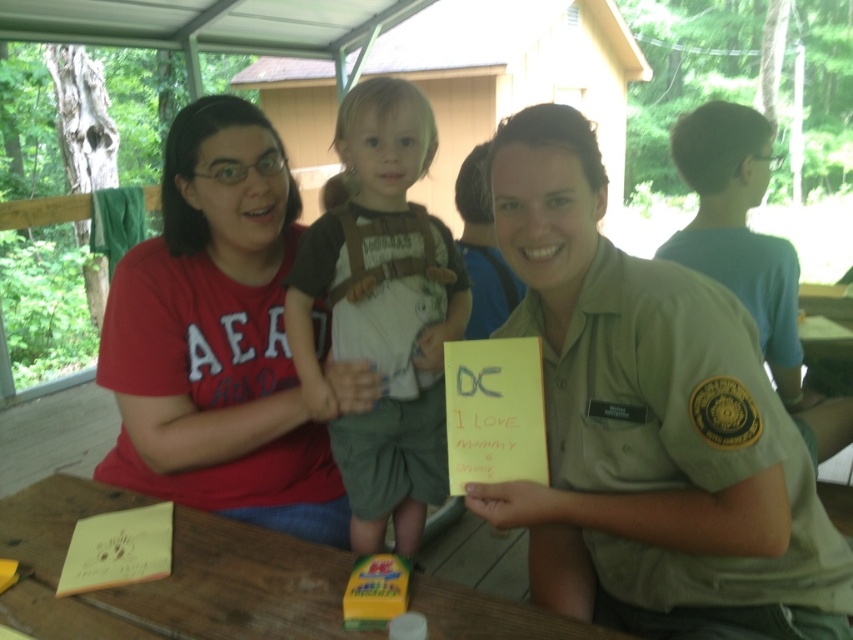
Question: Which point appears closest to the camera in this image?

Choices:
 (A) (843, 417)
 (B) (177, 426)
 (C) (440, 637)
 (D) (457, 328)

Answer: (C)

Question: Which point appears closest to the camera in this image?

Choices:
 (A) (730, 230)
 (B) (25, 560)

Answer: (B)

Question: Can you confirm if brown cotton shirt at center is positioned to the left of blue cotton shirt at upper right?

Choices:
 (A) yes
 (B) no

Answer: (A)

Question: Is matte red t-shirt at left above wooden table at lower center?

Choices:
 (A) no
 (B) yes

Answer: (B)

Question: Is matte red t-shirt at left thinner than wooden table at lower center?

Choices:
 (A) yes
 (B) no

Answer: (A)

Question: Which object appears closest to the camera in this image?

Choices:
 (A) brown cotton shirt at center
 (B) wooden table at lower center
 (C) matte red t-shirt at left

Answer: (B)